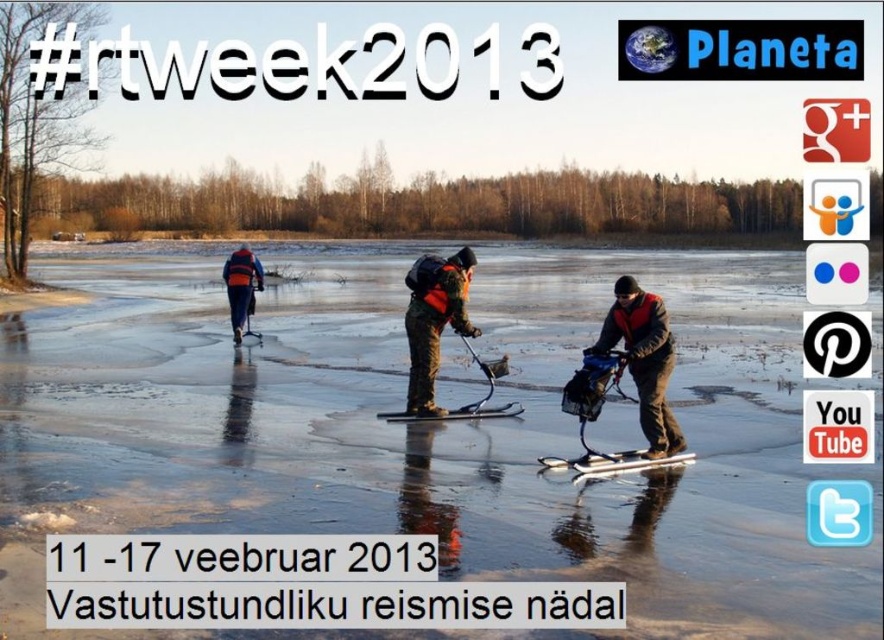
Question: Observing the image, what is the correct spatial positioning of dark gray fabric jacket at center in reference to camouflage jacket at center?

Choices:
 (A) right
 (B) left

Answer: (A)

Question: Which point is closer to the camera?

Choices:
 (A) orange life vest at center
 (B) camouflage jacket at center

Answer: (B)

Question: Which of the following is the closest to the observer?

Choices:
 (A) (448, 278)
 (B) (248, 259)

Answer: (A)

Question: Which of the following is the farthest from the observer?

Choices:
 (A) (621, 285)
 (B) (456, 330)
 (C) (235, 253)

Answer: (C)

Question: Does dark gray fabric jacket at center have a lesser width compared to orange life vest at center?

Choices:
 (A) yes
 (B) no

Answer: (B)

Question: Is camouflage jacket at center further to camera compared to orange life vest at center?

Choices:
 (A) yes
 (B) no

Answer: (B)